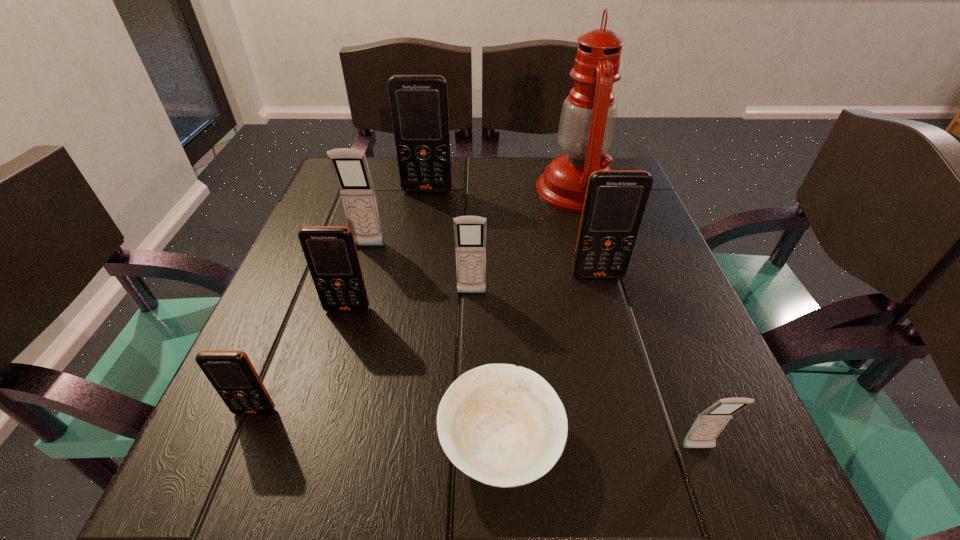
Locate an element on the screen. The width and height of the screenshot is (960, 540). gray cellular telephone that can be found as the second closest to the eighth shortest object is located at coordinates (470, 231).

I want to click on gray cellular telephone that can be found as the closest to the second nearest orange cellular telephone, so click(x=350, y=166).